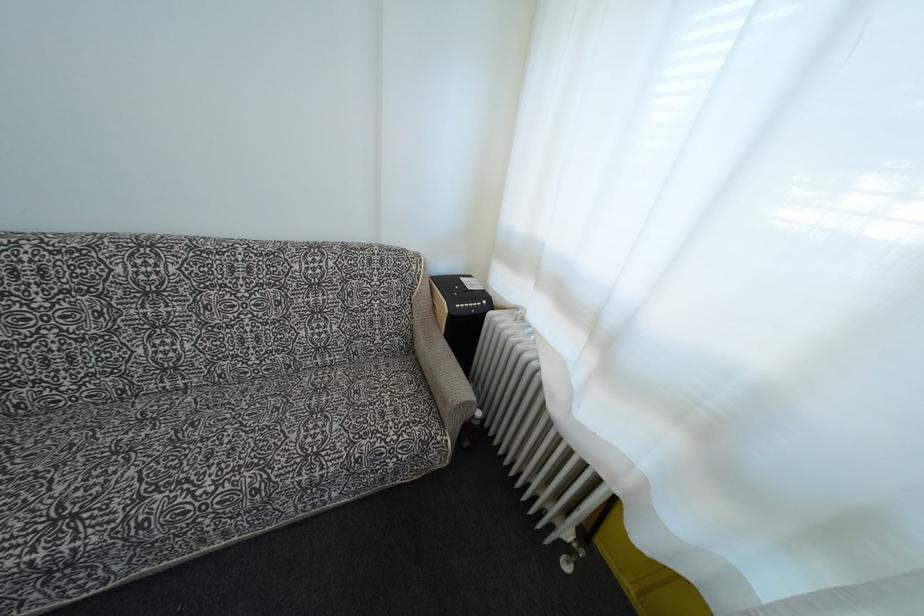
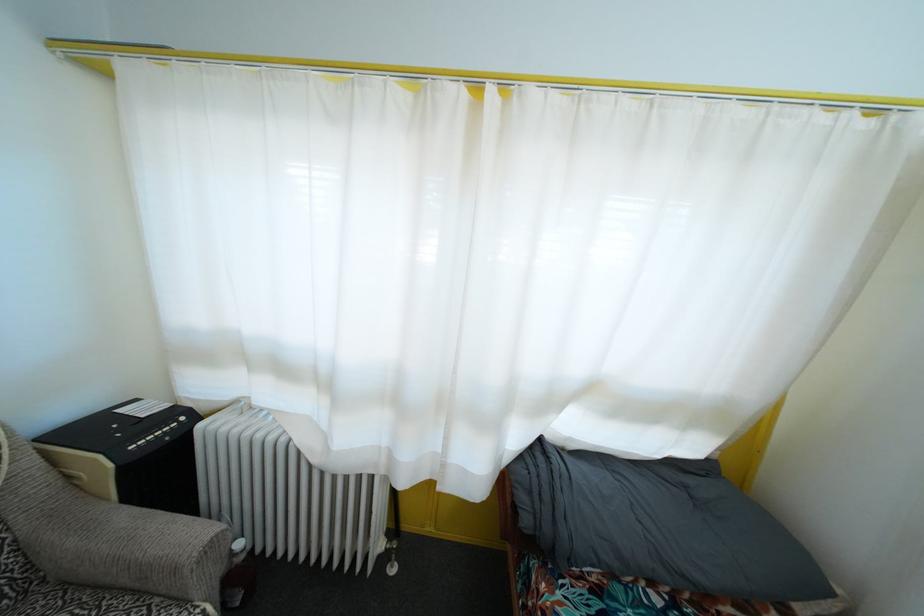
Where in the second image is the point corresponding to [439,416] from the first image?

(161, 608)